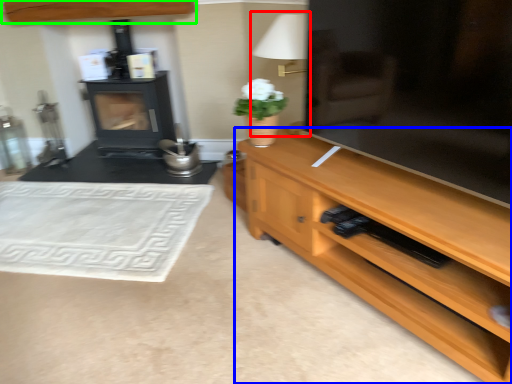
Question: Which object is the farthest from table lamp (highlighted by a red box)? Choose among these: desk (highlighted by a blue box) or cabinetry (highlighted by a green box).

Choices:
 (A) desk
 (B) cabinetry

Answer: (B)